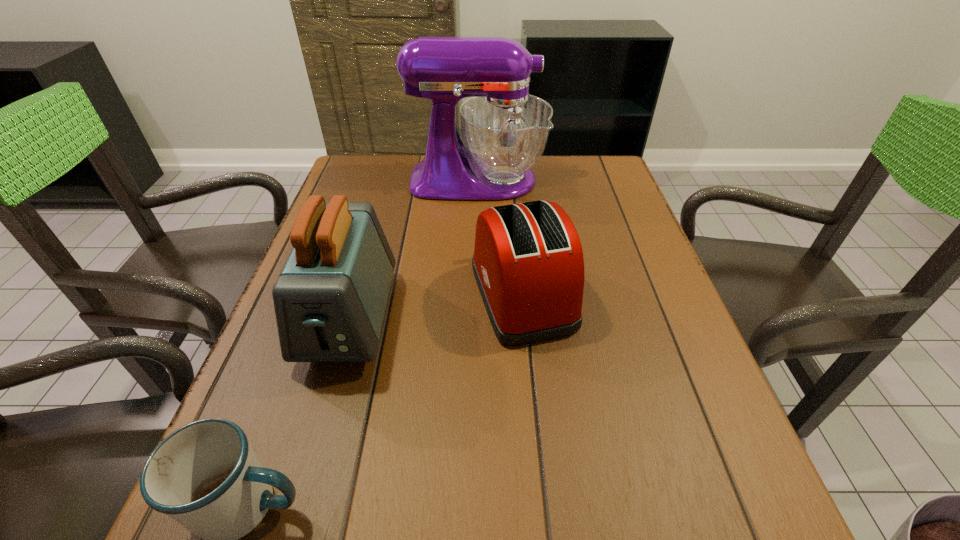
Where is `vacant area that lies between the farthest object and the left toaster`? vacant area that lies between the farthest object and the left toaster is located at coordinates (414, 249).

Select which object is the second closest to the nearest object. Please provide its 2D coordinates. Your answer should be formatted as a tuple, i.e. [(x, y)], where the tuple contains the x and y coordinates of a point satisfying the conditions above.

[(528, 264)]

Select which object is the third closest to the second tallest object. Please provide its 2D coordinates. Your answer should be formatted as a tuple, i.e. [(x, y)], where the tuple contains the x and y coordinates of a point satisfying the conditions above.

[(505, 130)]

Image resolution: width=960 pixels, height=540 pixels. What are the coordinates of `free space that satisfies the following two spatial constraints: 1. at the bowl opening of the farthest object; 2. on the front-facing side of the left toaster` in the screenshot? It's located at (477, 319).

At what (x,y) coordinates should I click in order to perform the action: click on vacant space that satisfies the following two spatial constraints: 1. at the bowl opening of the mixer; 2. on the front-facing side of the second tallest object. Please return your answer as a coordinate pair (x, y). Looking at the image, I should click on (477, 319).

The image size is (960, 540). What are the coordinates of `blank area in the image that satisfies the following two spatial constraints: 1. at the bowl opening of the mixer; 2. on the back side of the third tallest object` in the screenshot? It's located at (477, 294).

Where is `free location that satisfies the following two spatial constraints: 1. at the bowl opening of the farthest object; 2. on the back side of the second shortest object`? free location that satisfies the following two spatial constraints: 1. at the bowl opening of the farthest object; 2. on the back side of the second shortest object is located at coordinates (477, 294).